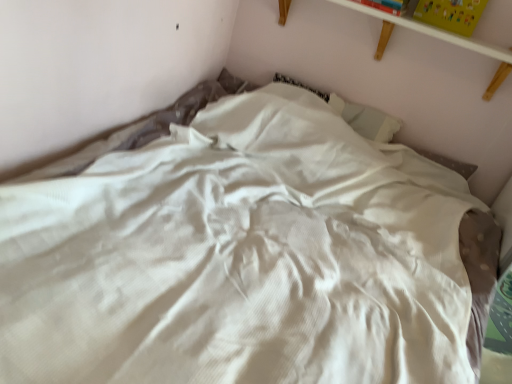
Question: Is yellow matte paper at upper right, which is counted as the second paperback book, starting from the left, wider than white wooden shelf at upper center?

Choices:
 (A) yes
 (B) no

Answer: (B)

Question: Could you tell me if yellow matte paper at upper right, which is counted as the 1th paperback book, starting from the right, is facing white wooden shelf at upper center?

Choices:
 (A) no
 (B) yes

Answer: (A)

Question: Is yellow matte paper at upper right, which is counted as the 1th paperback book, starting from the right, shorter than white wooden shelf at upper center?

Choices:
 (A) yes
 (B) no

Answer: (B)

Question: Is yellow matte paper at upper right, which is counted as the second paperback book, starting from the left, positioned far away from white wooden shelf at upper center?

Choices:
 (A) yes
 (B) no

Answer: (B)

Question: Is yellow matte paper at upper right, which is counted as the 1th paperback book, starting from the right, thinner than white wooden shelf at upper center?

Choices:
 (A) yes
 (B) no

Answer: (A)

Question: From a real-world perspective, is yellow matte paper at upper right, which is counted as the second paperback book, starting from the left, under white wooden shelf at upper center?

Choices:
 (A) yes
 (B) no

Answer: (B)

Question: Considering the relative sizes of hardcover book at upper right, the 1th paperback book in the left-to-right sequence, and white wooden shelf at upper center in the image provided, is hardcover book at upper right, the 1th paperback book in the left-to-right sequence, taller than white wooden shelf at upper center?

Choices:
 (A) no
 (B) yes

Answer: (A)

Question: Could you tell me if hardcover book at upper right, the 2th paperback book from the right, is turned towards white wooden shelf at upper center?

Choices:
 (A) no
 (B) yes

Answer: (A)

Question: Is hardcover book at upper right, the 2th paperback book from the right, thinner than white wooden shelf at upper center?

Choices:
 (A) yes
 (B) no

Answer: (A)

Question: Considering the relative positions of hardcover book at upper right, the 2th paperback book from the right, and white wooden shelf at upper center in the image provided, is hardcover book at upper right, the 2th paperback book from the right, in front of white wooden shelf at upper center?

Choices:
 (A) no
 (B) yes

Answer: (A)

Question: Is hardcover book at upper right, the 1th paperback book in the left-to-right sequence, bigger than white wooden shelf at upper center?

Choices:
 (A) no
 (B) yes

Answer: (A)

Question: Considering the relative sizes of hardcover book at upper right, the 1th paperback book in the left-to-right sequence, and white wooden shelf at upper center in the image provided, is hardcover book at upper right, the 1th paperback book in the left-to-right sequence, smaller than white wooden shelf at upper center?

Choices:
 (A) no
 (B) yes

Answer: (B)

Question: Can you confirm if white wooden shelf at upper center is wider than yellow matte paper at upper right, which is counted as the second paperback book, starting from the left?

Choices:
 (A) no
 (B) yes

Answer: (B)